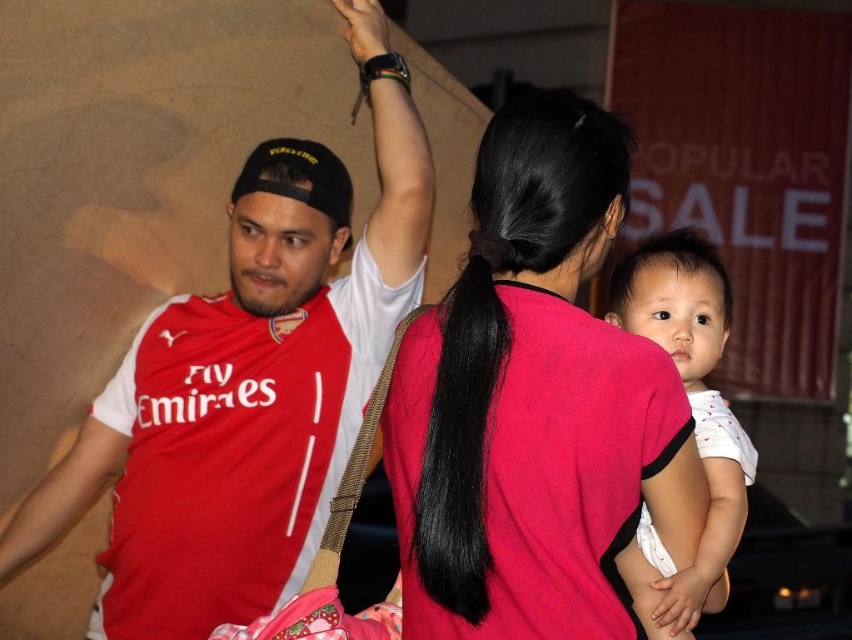
Between point (346, 448) and point (419, 528), which one is positioned behind?

The point (346, 448) is more distant.

Which of these two, matte jersey at center or black silky hair at center, stands shorter?

black silky hair at center

What do you see at coordinates (248, 381) in the screenshot?
I see `matte jersey at center` at bounding box center [248, 381].

Identify the location of matte jersey at center. (248, 381).

Is point (700, 289) positioned in front of point (390, 269)?

Yes, it is in front of point (390, 269).

The height and width of the screenshot is (640, 852). What do you see at coordinates (689, 404) in the screenshot? I see `white soft fabric baby at center` at bounding box center [689, 404].

You are a GUI agent. You are given a task and a screenshot of the screen. Output one action in this format:
    pyautogui.click(x=<x>, y=<y>)
    Task: Click on the white soft fabric baby at center
    The image size is (852, 640).
    Given the screenshot: What is the action you would take?
    (689, 404)

Measure the distance between matte jersey at center and matte pink shirt at center.

They are 3.97 feet apart.

Identify the location of matte jersey at center. The height and width of the screenshot is (640, 852). (248, 381).